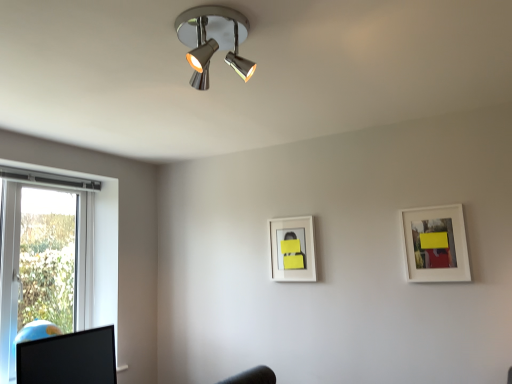
Question: From a real-world perspective, is chrome/metallic spotlight at upper center on top of white matte picture frame at upper right, placed as the 2th picture frame when sorted from back to front?

Choices:
 (A) no
 (B) yes

Answer: (B)

Question: Is chrome/metallic spotlight at upper center at the right side of white matte picture frame at upper right, which is the first picture frame from front to back?

Choices:
 (A) yes
 (B) no

Answer: (B)

Question: From the image's perspective, is chrome/metallic spotlight at upper center over white matte picture frame at upper right, which is the first picture frame from front to back?

Choices:
 (A) yes
 (B) no

Answer: (A)

Question: Could you tell me if chrome/metallic spotlight at upper center is facing white matte picture frame at upper right, placed as the 2th picture frame when sorted from back to front?

Choices:
 (A) no
 (B) yes

Answer: (A)

Question: Is chrome/metallic spotlight at upper center with white matte picture frame at upper right, arranged as the first picture frame when viewed from the right?

Choices:
 (A) yes
 (B) no

Answer: (B)

Question: Can you confirm if chrome/metallic spotlight at upper center is positioned to the left of white matte picture frame at upper right, arranged as the first picture frame when viewed from the right?

Choices:
 (A) no
 (B) yes

Answer: (B)

Question: Can you confirm if black glossy computer monitor at lower left is smaller than white matte picture frame at upper right, which appears as the second picture frame when viewed from the left?

Choices:
 (A) no
 (B) yes

Answer: (A)

Question: Can you confirm if black glossy computer monitor at lower left is thinner than white matte picture frame at upper right, which is the first picture frame from front to back?

Choices:
 (A) yes
 (B) no

Answer: (B)

Question: From the image's perspective, does black glossy computer monitor at lower left appear lower than white matte picture frame at upper right, placed as the 2th picture frame when sorted from back to front?

Choices:
 (A) yes
 (B) no

Answer: (A)

Question: Is black glossy computer monitor at lower left aimed at white matte picture frame at upper right, which appears as the second picture frame when viewed from the left?

Choices:
 (A) yes
 (B) no

Answer: (A)

Question: From a real-world perspective, is black glossy computer monitor at lower left over white matte picture frame at upper right, which appears as the second picture frame when viewed from the left?

Choices:
 (A) no
 (B) yes

Answer: (A)

Question: Is black glossy computer monitor at lower left surrounding white matte picture frame at upper right, arranged as the first picture frame when viewed from the right?

Choices:
 (A) no
 (B) yes

Answer: (A)

Question: Would you say white matte picture frame at center, the first picture frame when ordered from left to right, is part of white matte picture frame at upper right, placed as the 2th picture frame when sorted from back to front,'s contents?

Choices:
 (A) yes
 (B) no

Answer: (B)